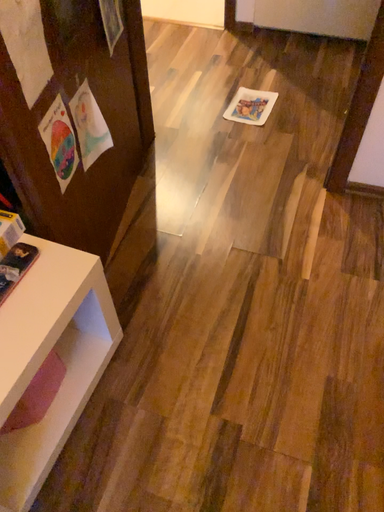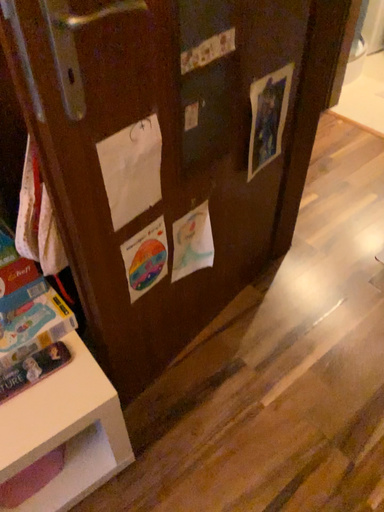
Question: Which way did the camera rotate in the video?

Choices:
 (A) rotated right
 (B) rotated left

Answer: (B)